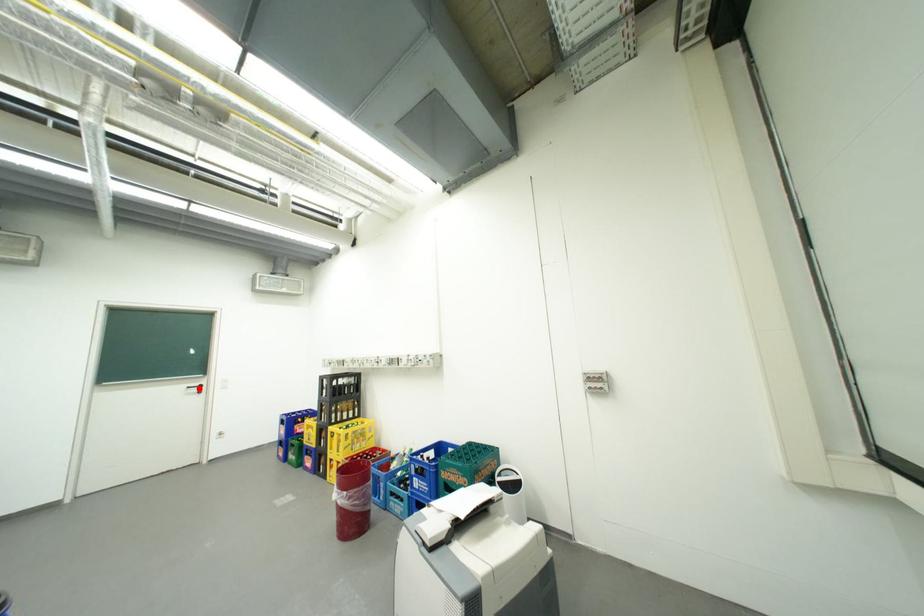
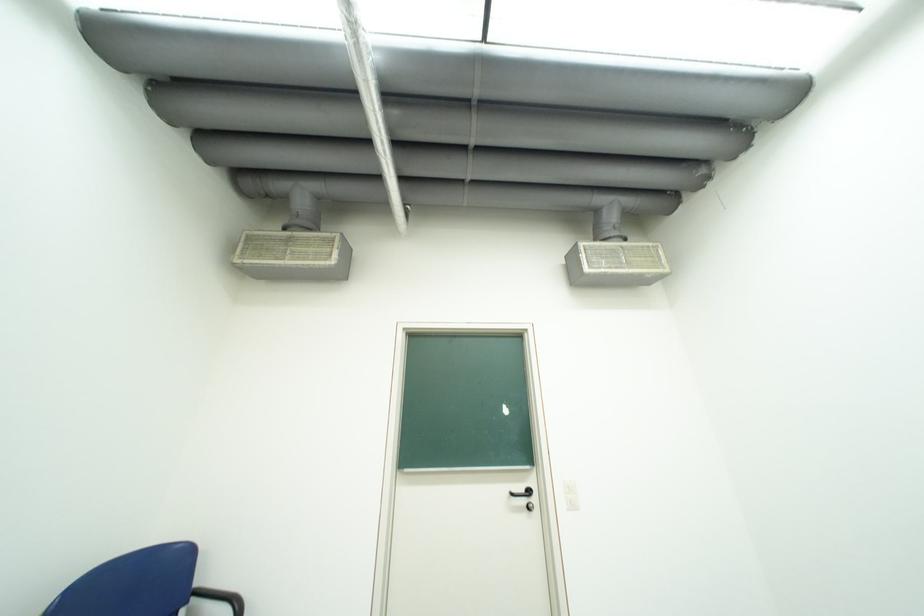
Find the pixel in the second image that matches the highlighted location in the first image.

(523, 495)